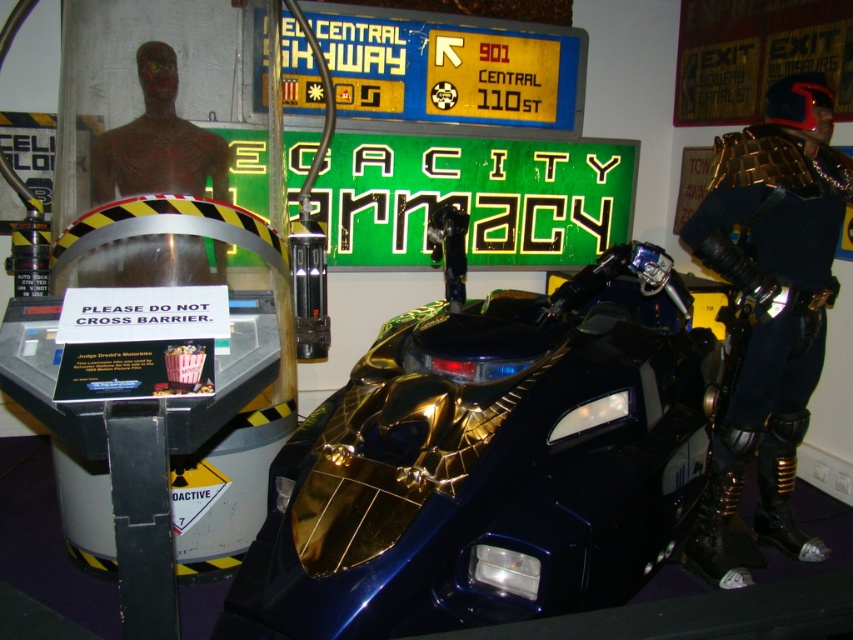
Question: Which point is closer to the camera?

Choices:
 (A) (683, 349)
 (B) (94, 202)
 (C) (801, 289)

Answer: (A)

Question: Can you confirm if gold-plated motorcycle at center is bigger than smooth brown bust at center?

Choices:
 (A) no
 (B) yes

Answer: (B)

Question: Which object is farther from the camera taking this photo?

Choices:
 (A) gold plated armor at center
 (B) smooth brown bust at center
 (C) gold-plated motorcycle at center

Answer: (A)

Question: In this image, where is gold-plated motorcycle at center located relative to gold plated armor at center?

Choices:
 (A) right
 (B) left

Answer: (B)

Question: Which point is closer to the camera?

Choices:
 (A) gold plated armor at center
 (B) smooth brown bust at center

Answer: (B)

Question: Does gold-plated motorcycle at center have a lesser width compared to gold plated armor at center?

Choices:
 (A) yes
 (B) no

Answer: (B)